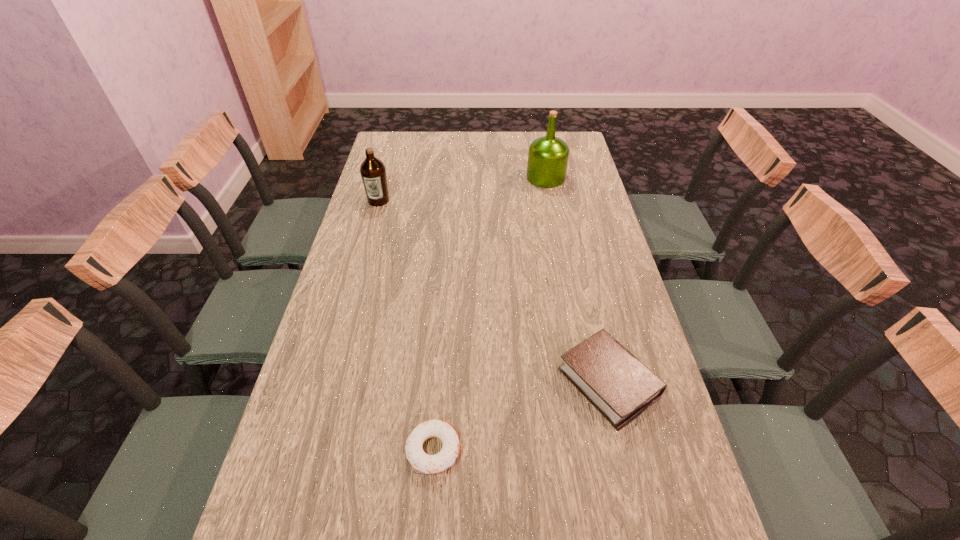
At what (x,y) coordinates should I click in order to perform the action: click on free area in between the tallest object and the leftmost object. Please return your answer as a coordinate pair (x, y). Looking at the image, I should click on (462, 189).

The image size is (960, 540). I want to click on vacant point located between the doughnut and the third tallest object, so click(521, 416).

This screenshot has width=960, height=540. Identify the location of vacant area that lies between the third tallest object and the nearer olive oil. (493, 292).

Identify the location of empty space between the doughnut and the third tallest object. (521, 416).

Where is `vacant area that lies between the shortest object and the Bible`? The width and height of the screenshot is (960, 540). vacant area that lies between the shortest object and the Bible is located at coordinates (521, 416).

Find the location of `free space between the right olive oil and the Bible`. free space between the right olive oil and the Bible is located at coordinates click(577, 280).

I want to click on vacant region between the nearer olive oil and the Bible, so click(493, 292).

This screenshot has height=540, width=960. What are the coordinates of `vacant space that is in between the farthest object and the nearer olive oil` in the screenshot? It's located at (462, 189).

I want to click on the second closest object to the third nearest object, so click(611, 378).

The width and height of the screenshot is (960, 540). I want to click on object that can be found as the third closest to the second shortest object, so click(373, 172).